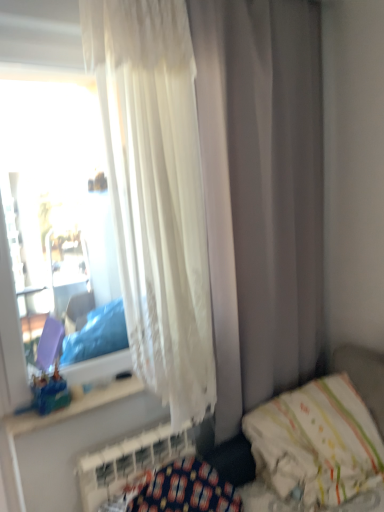
Question: Visually, is white textured radiator at lower left positioned to the left or to the right of white soft pillow at lower right?

Choices:
 (A) right
 (B) left

Answer: (B)

Question: Considering the positions of point (109, 449) and point (258, 441), is point (109, 449) closer or farther from the camera than point (258, 441)?

Choices:
 (A) closer
 (B) farther

Answer: (A)

Question: Which is farther from the white soft pillow at lower right?

Choices:
 (A) white fabric hospital bed at lower right
 (B) white textured radiator at lower left
 (C) translucent plastic toy at window
 (D) white sheer curtain at upper left

Answer: (C)

Question: Which object is positioned farthest from the white sheer curtain at upper left?

Choices:
 (A) white textured radiator at lower left
 (B) white soft pillow at lower right
 (C) white fabric hospital bed at lower right
 (D) translucent plastic toy at window

Answer: (D)